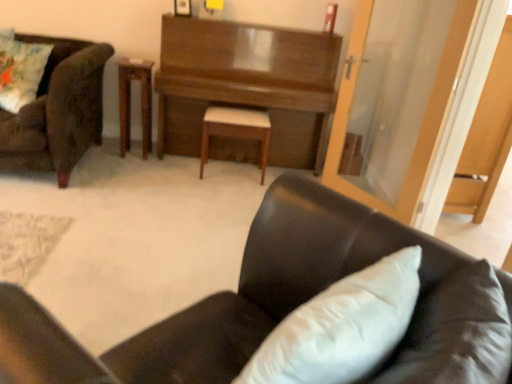
Find the location of `vacant area located to the right-hand side of wooden table at center`. vacant area located to the right-hand side of wooden table at center is located at coordinates (161, 162).